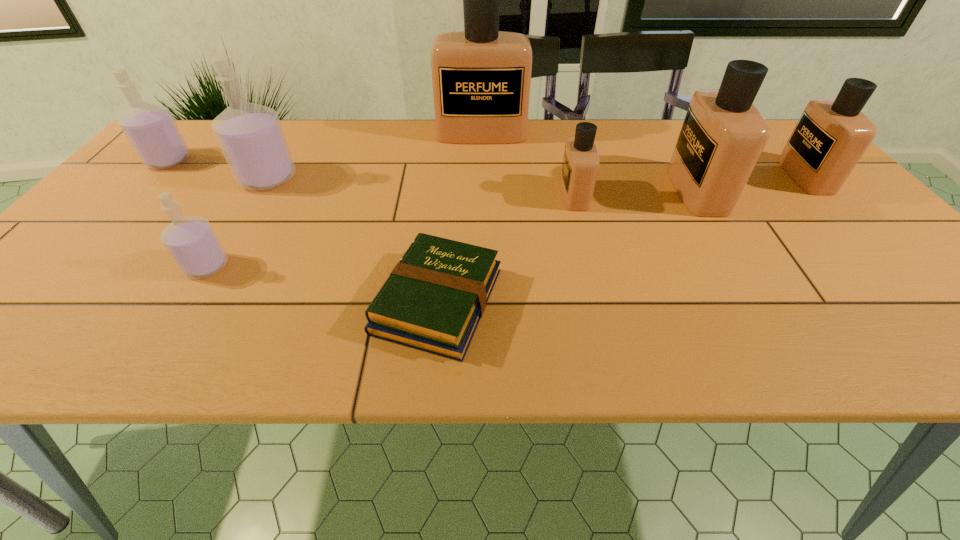
At what (x,y) coordinates should I click in order to perform the action: click on vacant space in between the nearest perfume and the tallest object. Please return your answer as a coordinate pair (x, y). Looking at the image, I should click on (344, 200).

You are a GUI agent. You are given a task and a screenshot of the screen. Output one action in this format:
    pyautogui.click(x=<x>, y=<y>)
    Task: Click on the free space between the second biggest beige perfume and the leftmost perfume
    
    Given the screenshot: What is the action you would take?
    pyautogui.click(x=433, y=176)

Locate an element on the screen. This screenshot has height=540, width=960. empty location between the shortest object and the rightmost object is located at coordinates (622, 239).

At what (x,y) coordinates should I click in order to perform the action: click on free space between the brown book and the farthest beige perfume. Please return your answer as a coordinate pair (x, y). Looking at the image, I should click on (460, 217).

The height and width of the screenshot is (540, 960). Identify the location of vacant region between the sixth object from left to right and the sixth perfume from left to right. (636, 193).

Find the location of a particular element. The height and width of the screenshot is (540, 960). vacant point located between the book and the leftmost perfume is located at coordinates (303, 231).

Find the location of a particular element. free space between the leftmost perfume and the second object from right to left is located at coordinates (x=433, y=176).

Locate an element on the screen. The image size is (960, 540). unoccupied area between the second perfume from right to left and the nearest perfume is located at coordinates (452, 228).

The image size is (960, 540). I want to click on object identified as the second closest to the rightmost object, so click(580, 166).

Select which object is the second closest to the book. Please provide its 2D coordinates. Your answer should be formatted as a tuple, i.e. [(x, y)], where the tuple contains the x and y coordinates of a point satisfying the conditions above.

[(192, 243)]